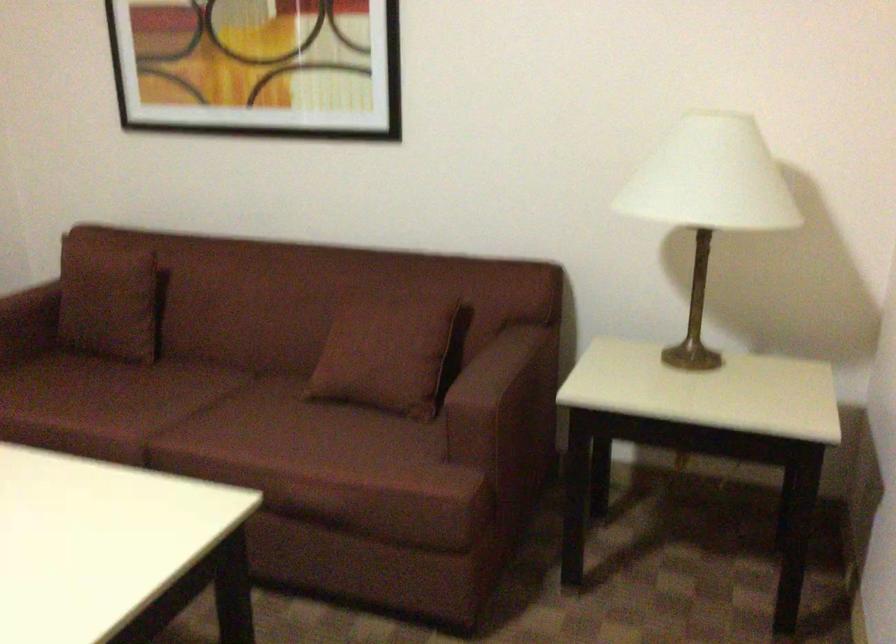
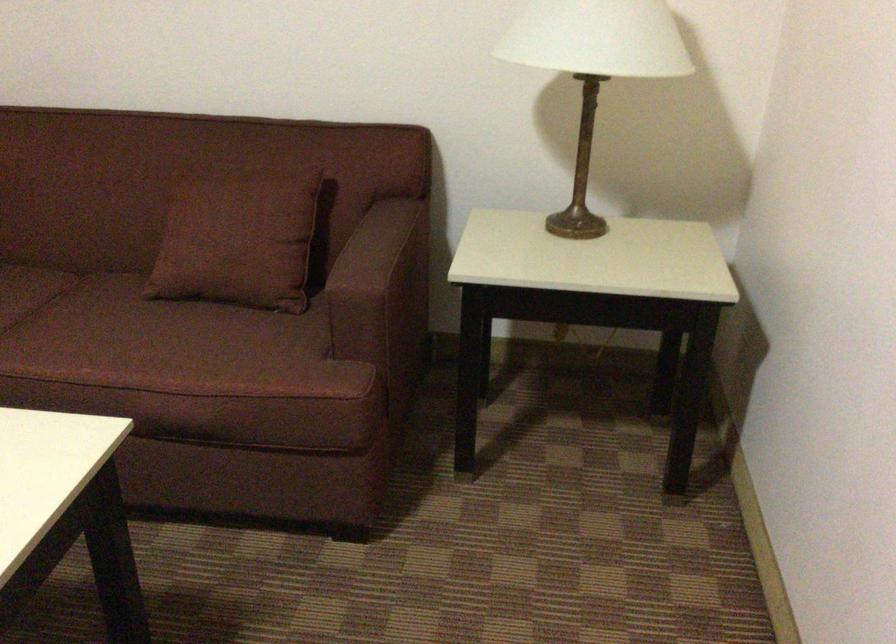
The point at (288, 433) is marked in the first image. Where is the corresponding point in the second image?

(135, 339)